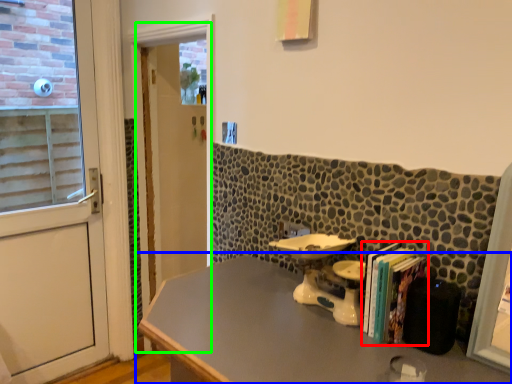
Question: Which object is the farthest from book (highlighted by a red box)? Choose among these: table (highlighted by a blue box) or screen door (highlighted by a green box).

Choices:
 (A) table
 (B) screen door

Answer: (B)